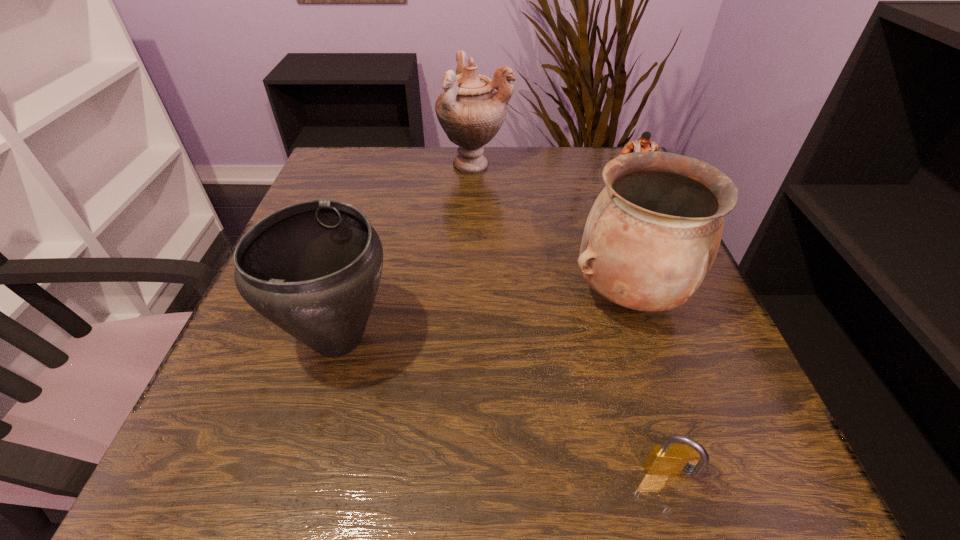
Locate an element on the screen. This screenshot has width=960, height=540. free space located 0.360m on the right of the leftmost object is located at coordinates (618, 338).

This screenshot has width=960, height=540. What are the coordinates of `vacant area situated on the front-facing side of the fourth tallest object` in the screenshot? It's located at (647, 249).

Where is `urn that is positioned at the far edge`? urn that is positioned at the far edge is located at coordinates (470, 111).

The image size is (960, 540). In order to click on puncher at the far edge in this screenshot , I will do `click(643, 143)`.

The height and width of the screenshot is (540, 960). In order to click on object located in the near edge section of the desktop in this screenshot , I will do `click(668, 459)`.

Identify the location of object present at the left edge. (313, 268).

Locate an element on the screen. urn situated at the right edge is located at coordinates (651, 237).

The width and height of the screenshot is (960, 540). In order to click on puncher at the right edge in this screenshot , I will do [643, 143].

I want to click on padlock that is at the right edge, so click(x=668, y=459).

Locate an element on the screen. Image resolution: width=960 pixels, height=540 pixels. object that is at the far right corner is located at coordinates [643, 143].